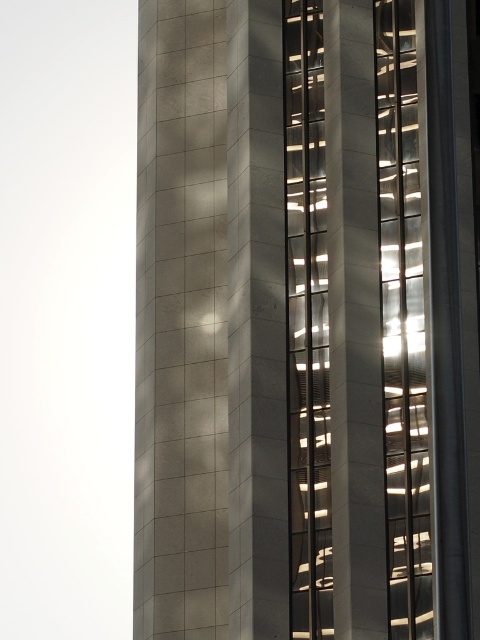
Question: Which of the following is the closest to the observer?

Choices:
 (A) (311, 563)
 (B) (380, 250)
 (C) (416, 336)

Answer: (A)

Question: Considering the relative positions of satin concrete tower at center and metallic reflective glass at right in the image provided, where is satin concrete tower at center located with respect to metallic reflective glass at right?

Choices:
 (A) below
 (B) above

Answer: (A)

Question: Does satin concrete tower at center come behind metallic reflective glass at right?

Choices:
 (A) no
 (B) yes

Answer: (A)

Question: Does satin concrete tower at center have a greater width compared to transparent glass elevator at center?

Choices:
 (A) yes
 (B) no

Answer: (A)

Question: Among these objects, which one is nearest to the camera?

Choices:
 (A) transparent glass elevator at center
 (B) metallic reflective glass at right

Answer: (B)

Question: Which object appears farthest from the camera in this image?

Choices:
 (A) satin concrete tower at center
 (B) metallic reflective glass at right
 (C) transparent glass elevator at center

Answer: (C)